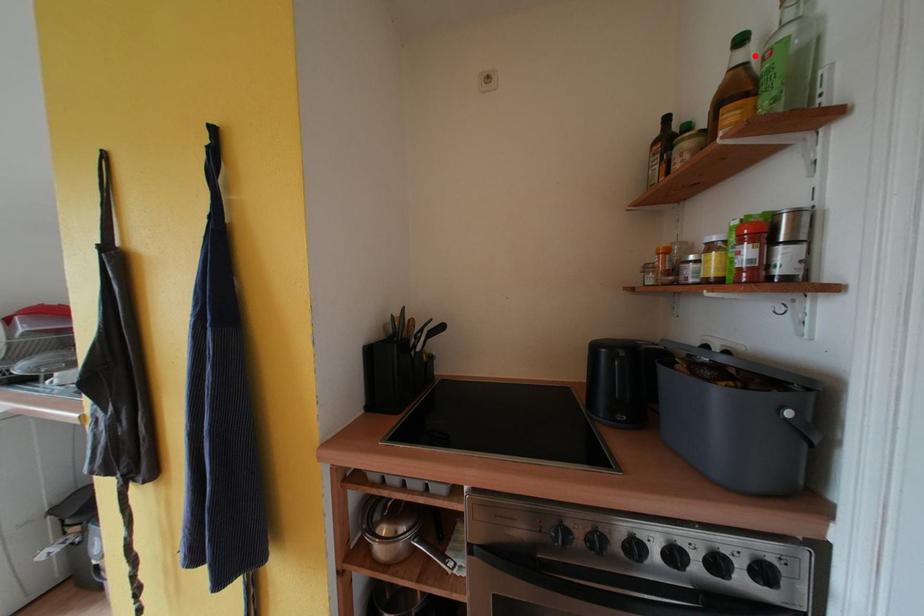
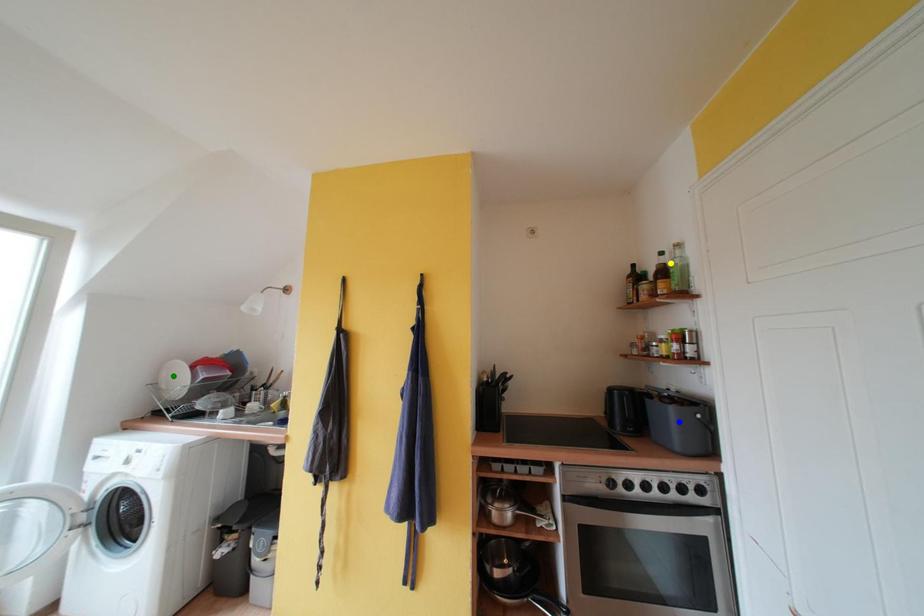
Question: I am providing you with two images of the same scene from different viewpoints. A red point is marked on the first image. You are given multiple points on the second image. Which point in image 2 represents the same 3d spot as the red point in image 1?

Choices:
 (A) blue point
 (B) yellow point
 (C) green point

Answer: (B)